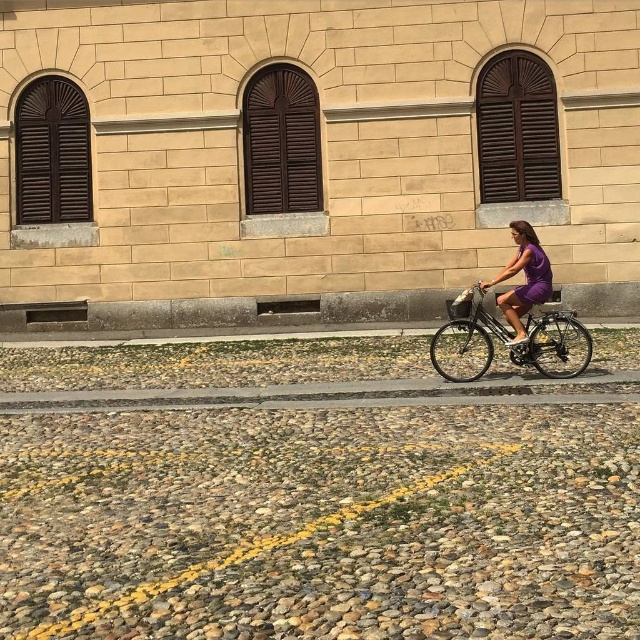
Question: Can you confirm if shiny metallic bicycle at right is positioned below purple matte dress at center?

Choices:
 (A) yes
 (B) no

Answer: (A)

Question: In this image, where is shiny metallic bicycle at right located relative to purple matte dress at center?

Choices:
 (A) left
 (B) right

Answer: (B)

Question: Can you confirm if shiny metallic bicycle at right is positioned below purple matte dress at center?

Choices:
 (A) no
 (B) yes

Answer: (B)

Question: Which point is farther to the camera?

Choices:
 (A) (529, 364)
 (B) (548, 289)

Answer: (B)

Question: Which point is farther to the camera?

Choices:
 (A) purple matte dress at center
 (B) shiny metallic bicycle at right

Answer: (B)